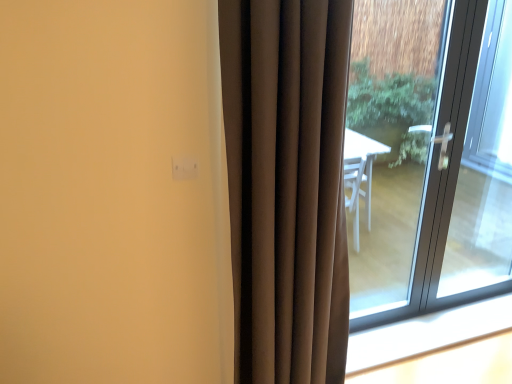
Question: Does clear glass door at right have a lesser width compared to white plastic window sill at lower right?

Choices:
 (A) no
 (B) yes

Answer: (B)

Question: Considering the relative positions of clear glass door at right and white plastic window sill at lower right in the image provided, is clear glass door at right in front of white plastic window sill at lower right?

Choices:
 (A) yes
 (B) no

Answer: (A)

Question: Is clear glass door at right next to white plastic window sill at lower right?

Choices:
 (A) yes
 (B) no

Answer: (B)

Question: Considering the relative sizes of clear glass door at right and white plastic window sill at lower right in the image provided, is clear glass door at right wider than white plastic window sill at lower right?

Choices:
 (A) no
 (B) yes

Answer: (A)

Question: From the image's perspective, is clear glass door at right over white plastic window sill at lower right?

Choices:
 (A) yes
 (B) no

Answer: (A)

Question: Is brown velvet curtain at center inside the boundaries of clear glass door at right, or outside?

Choices:
 (A) outside
 (B) inside

Answer: (A)

Question: Looking at their shapes, would you say brown velvet curtain at center is wider or thinner than clear glass door at right?

Choices:
 (A) wide
 (B) thin

Answer: (A)

Question: In terms of height, does brown velvet curtain at center look taller or shorter compared to clear glass door at right?

Choices:
 (A) tall
 (B) short

Answer: (B)

Question: Considering the positions of brown velvet curtain at center and clear glass door at right in the image, is brown velvet curtain at center bigger or smaller than clear glass door at right?

Choices:
 (A) small
 (B) big

Answer: (B)

Question: In terms of size, does transparent glass door at right appear bigger or smaller than clear glass door at right?

Choices:
 (A) small
 (B) big

Answer: (B)

Question: Is transparent glass door at right in front of or behind clear glass door at right in the image?

Choices:
 (A) front
 (B) behind

Answer: (A)

Question: Which is correct: transparent glass door at right is inside clear glass door at right, or outside of it?

Choices:
 (A) outside
 (B) inside

Answer: (A)

Question: Based on their positions, is transparent glass door at right located to the left or right of clear glass door at right?

Choices:
 (A) left
 (B) right

Answer: (A)

Question: Relative to transparent glass door at right, is clear glass door at right in front or behind?

Choices:
 (A) behind
 (B) front

Answer: (A)

Question: From a real-world perspective, relative to transparent glass door at right, is clear glass door at right vertically above or below?

Choices:
 (A) above
 (B) below

Answer: (B)